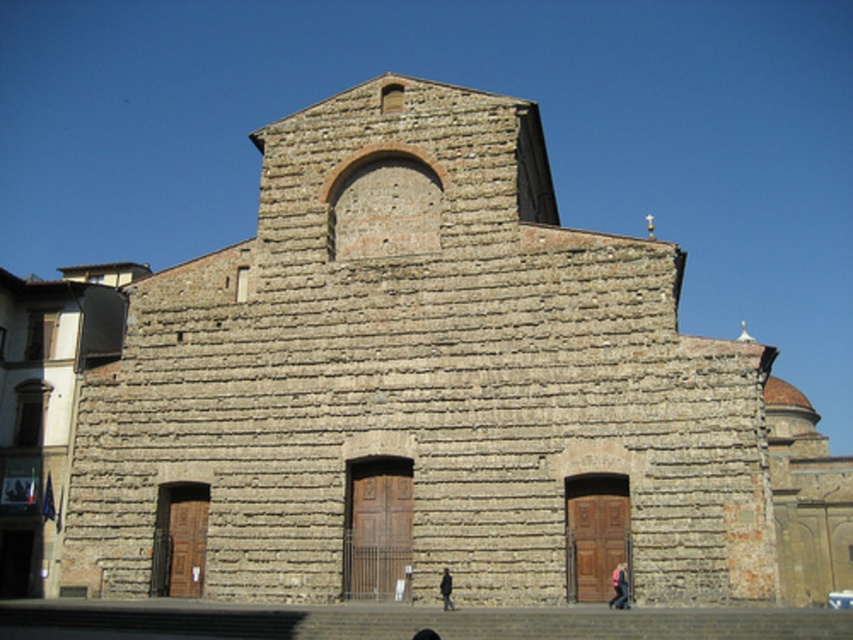
Question: Which of the following is the closest to the observer?

Choices:
 (A) (621, 582)
 (B) (424, 637)
 (C) (442, 600)

Answer: (B)

Question: Which object is closer to the camera taking this photo?

Choices:
 (A) pink fabric at lower right
 (B) dark gray jacket at center
 (C) dark brown leather shoe at lower center

Answer: (C)

Question: Does pink fabric at lower right have a greater width compared to dark brown leather shoe at lower center?

Choices:
 (A) yes
 (B) no

Answer: (B)

Question: Is pink fabric at lower right positioned at the back of dark gray jacket at center?

Choices:
 (A) yes
 (B) no

Answer: (B)

Question: Does pink fabric at lower right come in front of dark brown leather shoe at lower center?

Choices:
 (A) no
 (B) yes

Answer: (A)

Question: Considering the real-world distances, which object is farthest from the dark brown leather shoe at lower center?

Choices:
 (A) dark gray jacket at center
 (B) pink fabric at lower right

Answer: (B)